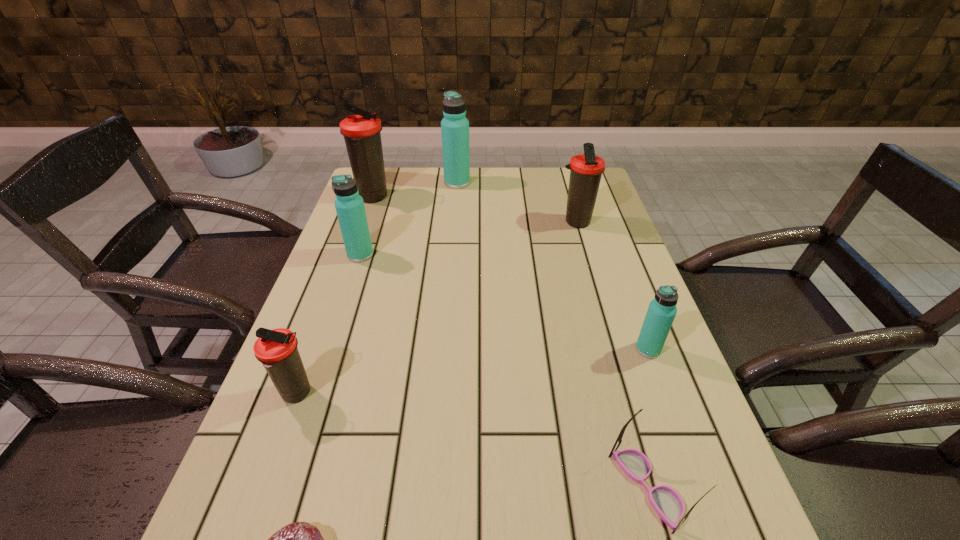
Where is `the nearest thermos bottle`? The height and width of the screenshot is (540, 960). the nearest thermos bottle is located at coordinates coord(276,349).

Where is `spectacles`? The width and height of the screenshot is (960, 540). spectacles is located at coordinates 668,504.

At what (x,y) coordinates should I click in order to perform the action: click on the second shortest object. Please return your answer as a coordinate pair (x, y). This screenshot has height=540, width=960. Looking at the image, I should click on (668, 504).

Image resolution: width=960 pixels, height=540 pixels. In order to click on vacant space situated on the right of the biggest brown thermos bottle in this screenshot , I will do `click(513, 198)`.

Where is `free region located 0.110m on the front of the biggest aqua thermos bottle`? free region located 0.110m on the front of the biggest aqua thermos bottle is located at coordinates (455, 207).

Locate an element on the screen. Image resolution: width=960 pixels, height=540 pixels. free space located 0.160m on the left of the rightmost brown thermos bottle is located at coordinates (505, 222).

At what (x,y) coordinates should I click in order to perform the action: click on vacant area situated on the front of the second smallest aqua thermos bottle. Please return your answer as a coordinate pair (x, y). Image resolution: width=960 pixels, height=540 pixels. Looking at the image, I should click on (344, 305).

Identify the location of free space located 0.280m on the front of the fifth farthest thermos bottle. (701, 492).

This screenshot has width=960, height=540. I want to click on vacant space located on the right of the nearest brown thermos bottle, so click(x=437, y=394).

You are a GUI agent. You are given a task and a screenshot of the screen. Output one action in this format:
    pyautogui.click(x=<x>, y=<y>)
    Task: Click on the free space located 0.340m on the left of the pink spectacles
    Image resolution: width=960 pixels, height=540 pixels.
    Given the screenshot: What is the action you would take?
    pyautogui.click(x=413, y=487)